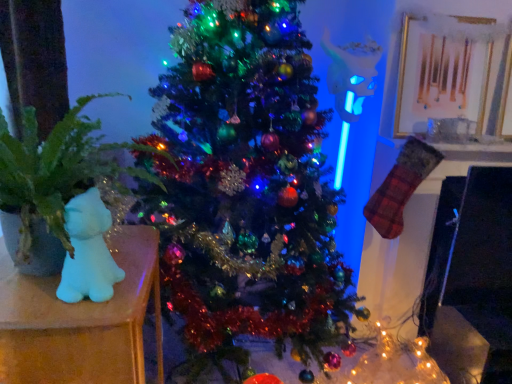
In order to face shiny green christmas tree at center, should I rotate leftwards or rightwards?

To face it directly, rotate right by 0.374 degrees.

The image size is (512, 384). Describe the element at coordinates (81, 321) in the screenshot. I see `white matte bear at left` at that location.

In order to face white matte bear at left, should I rotate leftwards or rightwards?

Rotate your view left by about 22.908°.

Locate an element on the screen. shiny green christmas tree at center is located at coordinates (246, 188).

From the image's perspective, who appears lower, white matte plush cat at left or white matte bear at left?

white matte bear at left, from the image's perspective.

Is white matte plush cat at left facing away from white matte bear at left?

No, white matte plush cat at left's orientation is not away from white matte bear at left.

Can you confirm if white matte plush cat at left is taller than white matte bear at left?

Incorrect, the height of white matte plush cat at left is not larger of that of white matte bear at left.

From a real-world perspective, between white matte plush cat at left and white matte bear at left, who is vertically lower?

white matte bear at left.

From the picture: Would you say green matte plant at left is part of white matte bear at left's contents?

No, green matte plant at left is not inside white matte bear at left.

Where is `houseplant on the right of white matte bear at left`? houseplant on the right of white matte bear at left is located at coordinates (53, 183).

Does point (0, 330) come behind point (100, 157)?

No, it is in front of (100, 157).

Considering the sizes of objects white matte bear at left and green matte plant at left in the image provided, who is shorter, white matte bear at left or green matte plant at left?

Standing shorter between the two is green matte plant at left.

From a real-world perspective, is white matte plush cat at left under green matte plant at left?

Indeed, from a real-world perspective, white matte plush cat at left is positioned beneath green matte plant at left.

How far apart are white matte plush cat at left and green matte plant at left?

5.39 inches.

Would you say white matte plush cat at left is inside or outside green matte plant at left?

white matte plush cat at left is spatially positioned inside green matte plant at left.

Considering the relative positions of white matte plush cat at left and green matte plant at left in the image provided, is white matte plush cat at left behind green matte plant at left?

Yes, the depth of white matte plush cat at left is greater than that of green matte plant at left.

From a real-world perspective, which object stands above the other?

green matte plant at left, from a real-world perspective.

Is green matte plant at left positioned far away from shiny green christmas tree at center?

No, green matte plant at left is not far away from shiny green christmas tree at center.

Between green matte plant at left and shiny green christmas tree at center, which one has less height?

Standing shorter between the two is green matte plant at left.

Can shiny green christmas tree at center be found inside green matte plant at left?

That's incorrect, shiny green christmas tree at center is not inside green matte plant at left.

Considering the positions of objects white matte bear at left and shiny green christmas tree at center in the image provided, who is more to the left, white matte bear at left or shiny green christmas tree at center?

From the viewer's perspective, white matte bear at left appears more on the left side.

From the image's perspective, is white matte bear at left located above shiny green christmas tree at center?

No, from the image's perspective, white matte bear at left is not above shiny green christmas tree at center.

Considering the sizes of objects white matte bear at left and shiny green christmas tree at center in the image provided, who is taller, white matte bear at left or shiny green christmas tree at center?

shiny green christmas tree at center is taller.

At what (x,y) coordinates should I click in order to perform the action: click on furniture to the left of shiny green christmas tree at center. Please return your answer as a coordinate pair (x, y). Image resolution: width=512 pixels, height=384 pixels. Looking at the image, I should click on (81, 321).

From the image's perspective, which one is positioned higher, shiny green christmas tree at center or green matte plant at left?

green matte plant at left is shown above in the image.

From the picture: How much distance is there between shiny green christmas tree at center and green matte plant at left?

shiny green christmas tree at center and green matte plant at left are 16.16 inches apart.

Are shiny green christmas tree at center and green matte plant at left beside each other?

shiny green christmas tree at center is not next to green matte plant at left, and they're not touching.

Considering the sizes of objects shiny green christmas tree at center and green matte plant at left in the image provided, who is taller, shiny green christmas tree at center or green matte plant at left?

shiny green christmas tree at center is taller.

Is green matte plant at left positioned before white matte plush cat at left?

Yes.

Considering the positions of point (71, 149) and point (98, 214), is point (71, 149) closer or farther from the camera than point (98, 214)?

Point (71, 149) is positioned farther from the camera compared to point (98, 214).

Visually, is green matte plant at left positioned to the left or to the right of white matte plush cat at left?

In the image, green matte plant at left appears on the left side of white matte plush cat at left.

Identify the location of furniture below the white matte plush cat at left (from the image's perspective). Image resolution: width=512 pixels, height=384 pixels. (81, 321).

This screenshot has height=384, width=512. In order to click on houseplant lying above the white matte bear at left (from the image's perspective) in this screenshot , I will do `click(53, 183)`.

Looking at the image, which one is located closer to white matte plush cat at left, white matte bear at left or shiny green christmas tree at center?

Based on the image, white matte bear at left appears to be nearer to white matte plush cat at left.

Considering their positions, is green matte plant at left positioned closer to white matte bear at left than white matte plush cat at left?

white matte plush cat at left is positioned closer to the anchor white matte bear at left.

When comparing their distances from green matte plant at left, does white matte bear at left or shiny green christmas tree at center seem closer?

Among the two, white matte bear at left is located nearer to green matte plant at left.

When comparing their distances from green matte plant at left, does shiny green christmas tree at center or white matte bear at left seem further?

shiny green christmas tree at center is further to green matte plant at left.

Looking at the image, which one is located further to white matte bear at left, shiny green christmas tree at center or green matte plant at left?

shiny green christmas tree at center is positioned further to the anchor white matte bear at left.

Which object lies nearer to the anchor point white matte bear at left, green matte plant at left or shiny green christmas tree at center?

Among the two, green matte plant at left is located nearer to white matte bear at left.

Looking at the image, which one is located further to green matte plant at left, white matte bear at left or white matte plush cat at left?

white matte bear at left lies further to green matte plant at left than the other object.

Looking at the image, which one is located closer to green matte plant at left, white matte plush cat at left or shiny green christmas tree at center?

white matte plush cat at left is closer to green matte plant at left.

Identify the location of toy situated between green matte plant at left and shiny green christmas tree at center from left to right. (x=88, y=251).

You are a GUI agent. You are given a task and a screenshot of the screen. Output one action in this format:
    pyautogui.click(x=<x>, y=<y>)
    Task: Click on the toy that lies between green matte plant at left and white matte bear at left from top to bottom
    The image size is (512, 384).
    Given the screenshot: What is the action you would take?
    pyautogui.click(x=88, y=251)

You are a GUI agent. You are given a task and a screenshot of the screen. Output one action in this format:
    pyautogui.click(x=<x>, y=<y>)
    Task: Click on the toy between white matte bear at left and shiny green christmas tree at center in the horizontal direction
    This screenshot has width=512, height=384.
    Given the screenshot: What is the action you would take?
    pyautogui.click(x=88, y=251)

Locate an element on the screen. This screenshot has width=512, height=384. houseplant between white matte bear at left and shiny green christmas tree at center from left to right is located at coordinates (53, 183).